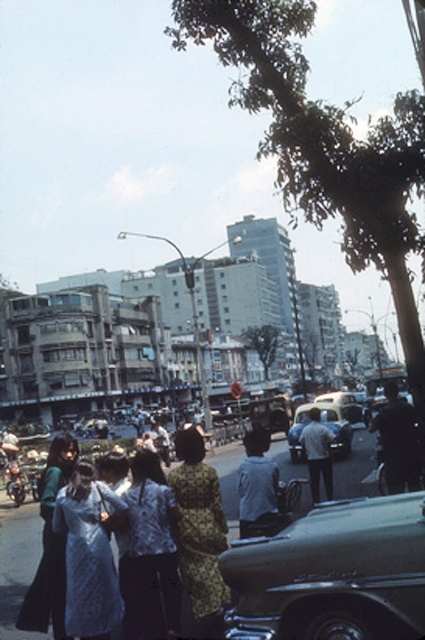
Is patterned fabric dress at center in front of metallic silver car at center?

Yes, it is.

Does patterned fabric dress at center come behind metallic silver car at center?

No.

Does point (183, 448) lie behind point (337, 426)?

No, (183, 448) is in front of (337, 426).

The width and height of the screenshot is (425, 640). In order to click on patterned fabric dress at center in this screenshot , I will do `click(200, 531)`.

Is point (319, 611) farther from viewer compared to point (152, 474)?

No, (319, 611) is in front of (152, 474).

Does shiny black car at center appear on the left side of printed fabric blouse at center?

No, shiny black car at center is not to the left of printed fabric blouse at center.

Does point (396, 612) come in front of point (167, 525)?

Yes.

The width and height of the screenshot is (425, 640). I want to click on shiny black car at center, so click(333, 573).

What do you see at coordinates (152, 548) in the screenshot? I see `printed fabric blouse at center` at bounding box center [152, 548].

Is printed fabric blouse at center above silky white dress at lower left?

Yes.

Is point (150, 584) more distant than point (39, 492)?

No, it is in front of (39, 492).

At what (x,y) coordinates should I click in order to perform the action: click on printed fabric blouse at center. Please return your answer as a coordinate pair (x, y). This screenshot has width=425, height=640. Looking at the image, I should click on (152, 548).